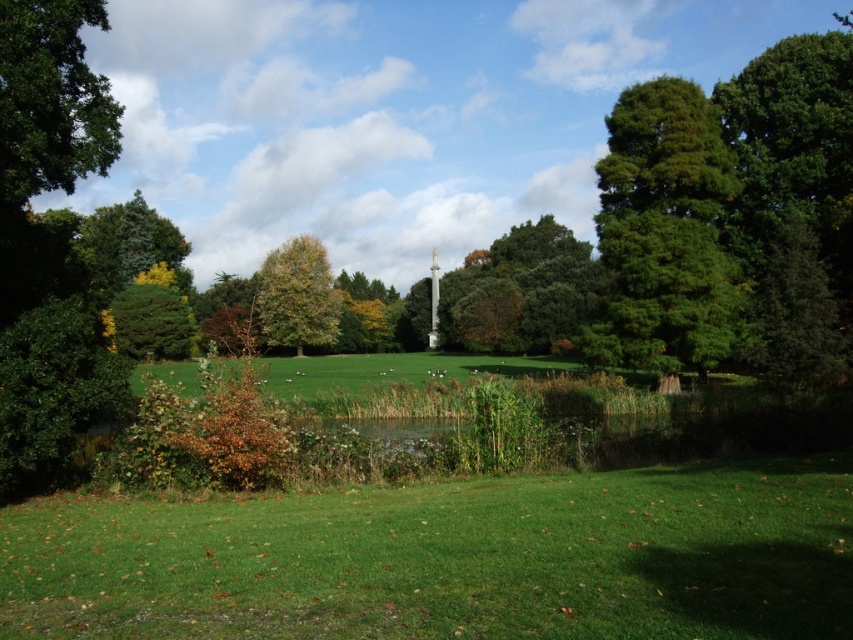
Is green grassy field at lower center below green leafy tree at center?

Yes, green grassy field at lower center is below green leafy tree at center.

Who is more distant from viewer, (512,508) or (305,323)?

Positioned behind is point (305,323).

This screenshot has height=640, width=853. Identify the location of green grassy field at lower center. (450, 560).

Is green leafy tree at upper left smaller than green leafy tree at center?

Correct, green leafy tree at upper left occupies less space than green leafy tree at center.

Is green leafy tree at upper left taller than green leafy tree at center?

In fact, green leafy tree at upper left may be shorter than green leafy tree at center.

Between point (64, 129) and point (258, 316), which one is positioned behind?

Point (258, 316)

This screenshot has width=853, height=640. Identify the location of green leafy tree at upper left. (51, 99).

Can you confirm if green glossy tree at right is shorter than green leafy tree at center?

Correct, green glossy tree at right is not as tall as green leafy tree at center.

Who is more distant from viewer, (x=637, y=269) or (x=305, y=236)?

The point (x=305, y=236) is more distant.

Identify the location of green glossy tree at right. (666, 228).